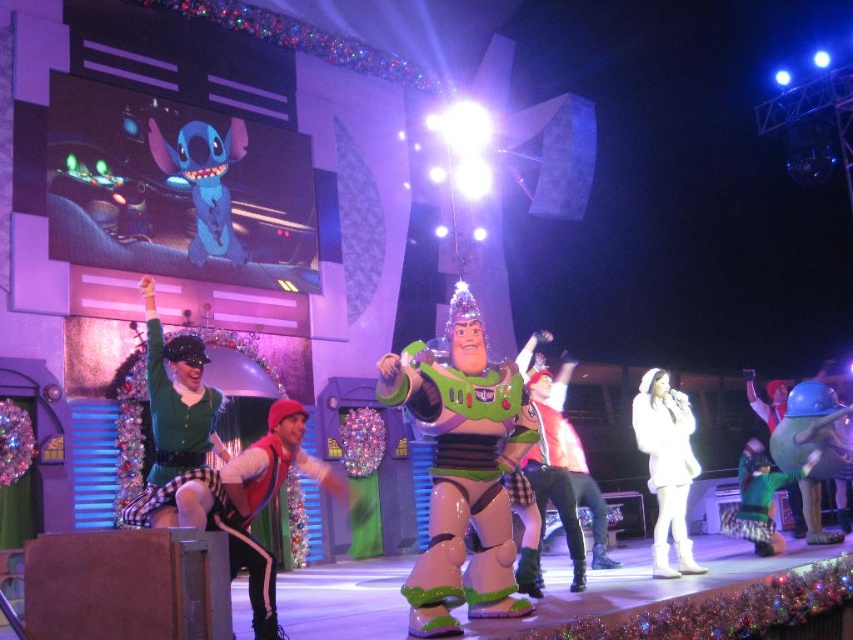
Is shiny plastic buzz lightyear at center above white fur coat at center?

Yes.

Can you confirm if shiny plastic buzz lightyear at center is wider than white fur coat at center?

Yes.

Is point (474, 552) farther from camera compared to point (666, 499)?

No.

Locate an element on the screen. The image size is (853, 640). shiny plastic buzz lightyear at center is located at coordinates (462, 468).

Does shiny plastic buzz lightyear at center have a greater height compared to green velvet santa hat at upper left?

Yes.

Can you confirm if shiny plastic buzz lightyear at center is shorter than green velvet santa hat at upper left?

No.

Which is behind, point (502, 582) or point (155, 353)?

The point (502, 582) is more distant.

At what (x,y) coordinates should I click in order to perform the action: click on shiny plastic buzz lightyear at center. Please return your answer as a coordinate pair (x, y). Image resolution: width=853 pixels, height=640 pixels. Looking at the image, I should click on (462, 468).

Does green fabric costume at center appear on the right side of green velvet santa hat at upper left?

Indeed, green fabric costume at center is positioned on the right side of green velvet santa hat at upper left.

Which is in front, point (221, 515) or point (183, 348)?

Point (221, 515) is more forward.

Image resolution: width=853 pixels, height=640 pixels. Find the location of `green fabric costume at center`. green fabric costume at center is located at coordinates (241, 502).